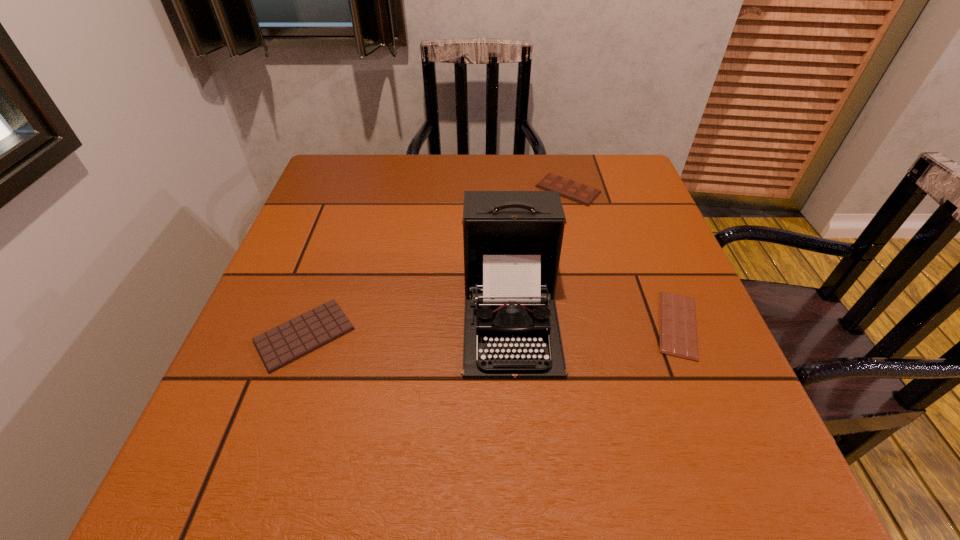
I want to click on free spot that satisfies the following two spatial constraints: 1. inside the open case of the shortest chocolate bar; 2. on the right side of the tallest object, so click(512, 325).

The height and width of the screenshot is (540, 960). What are the coordinates of `vacant region that satisfies the following two spatial constraints: 1. on the back side of the shortest chocolate bar; 2. on the right side of the leftmost object` in the screenshot? It's located at (308, 325).

Locate an element on the screen. free space that satisfies the following two spatial constraints: 1. inside the open case of the typewriter; 2. on the left side of the shortest chocolate bar is located at coordinates (512, 325).